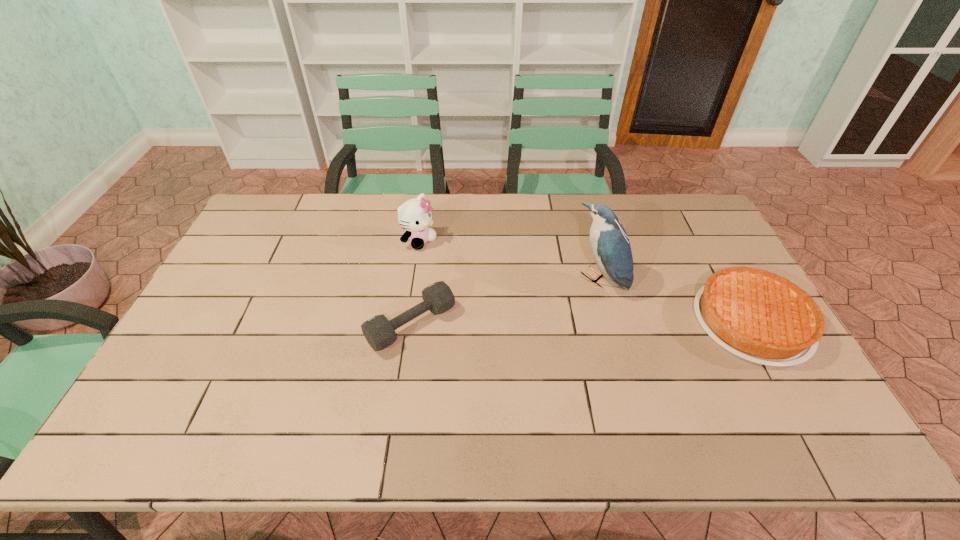
The width and height of the screenshot is (960, 540). I want to click on vacant space on the desktop that is between the dumbbell and the pie and is positioned at the tip of the second object from right to left's beak, so click(x=536, y=323).

In order to click on free space on the desktop that is between the dumbbell and the rightmost object and is positioned on the front-facing side of the farthest object in this screenshot , I will do `click(555, 323)`.